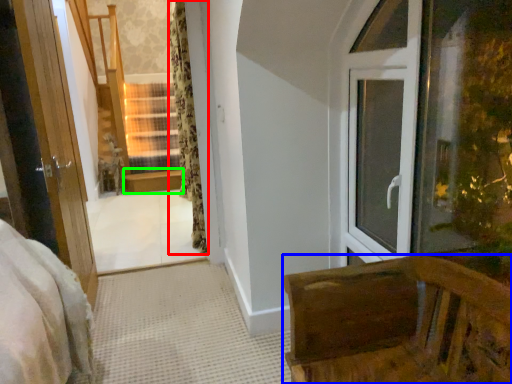
Question: Considering the real-world distances, which object is farthest from curtain (highlighted by a red box)? furniture (highlighted by a blue box) or window sill (highlighted by a green box)?

Choices:
 (A) furniture
 (B) window sill

Answer: (A)